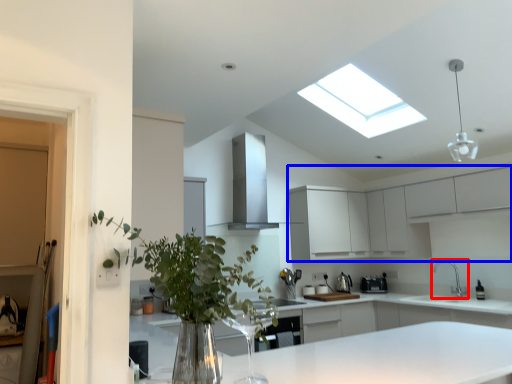
Question: Which object appears farthest to the camera in this image, tap (highlighted by a red box) or cabinetry (highlighted by a blue box)?

Choices:
 (A) tap
 (B) cabinetry

Answer: (A)